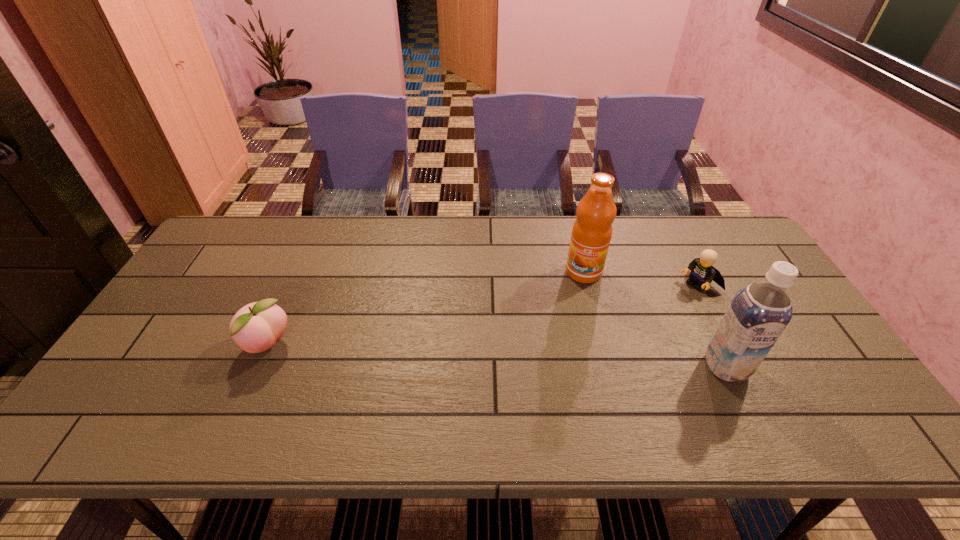
At what (x,y) coordinates should I click in order to perform the action: click on vacant spot on the desktop that is between the peach and the soya milk and is positioned on the front-facing side of the Lego. Please return your answer as a coordinate pair (x, y). Looking at the image, I should click on (557, 359).

Where is `vacant space on the desktop that is between the leftmost object and the soya milk and is positioned on the label side of the second object from left to right`? Image resolution: width=960 pixels, height=540 pixels. vacant space on the desktop that is between the leftmost object and the soya milk and is positioned on the label side of the second object from left to right is located at coordinates (549, 359).